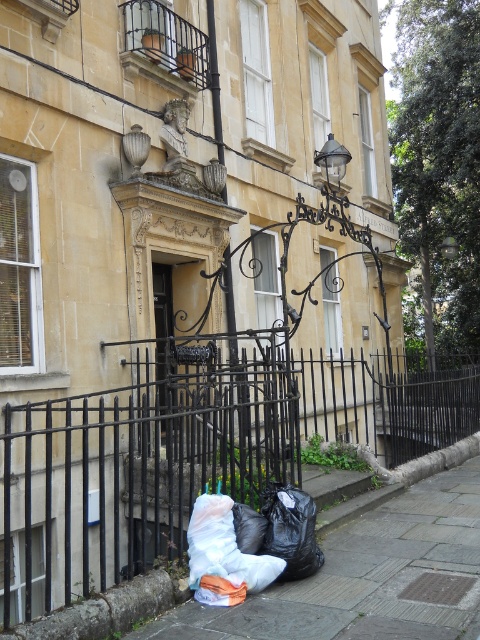
Is black metal fence at lower left shorter than white plastic bag at lower center?

In fact, black metal fence at lower left may be taller than white plastic bag at lower center.

Is black metal fence at lower left bigger than white plastic bag at lower center?

Yes.

You are a GUI agent. You are given a task and a screenshot of the screen. Output one action in this format:
    pyautogui.click(x=<x>, y=<y>)
    Task: Click on the black metal fence at lower left
    The height and width of the screenshot is (640, 480).
    Given the screenshot: What is the action you would take?
    pyautogui.click(x=189, y=452)

Describe the element at coordinates (189, 452) in the screenshot. The width and height of the screenshot is (480, 640). I see `black metal fence at lower left` at that location.

Between black metal fence at lower left and black plastic bags at lower center, which one is positioned higher?

black metal fence at lower left is above.

Find the location of a particular element. black metal fence at lower left is located at coordinates (189, 452).

Who is taller, black plastic bags at lower center or white plastic bag at lower center?

white plastic bag at lower center is taller.

Which is above, black plastic bags at lower center or white plastic bag at lower center?

white plastic bag at lower center is above.

The image size is (480, 640). I want to click on black plastic bags at lower center, so click(x=365, y=577).

Find the location of a particular element. The height and width of the screenshot is (640, 480). black plastic bags at lower center is located at coordinates (365, 577).